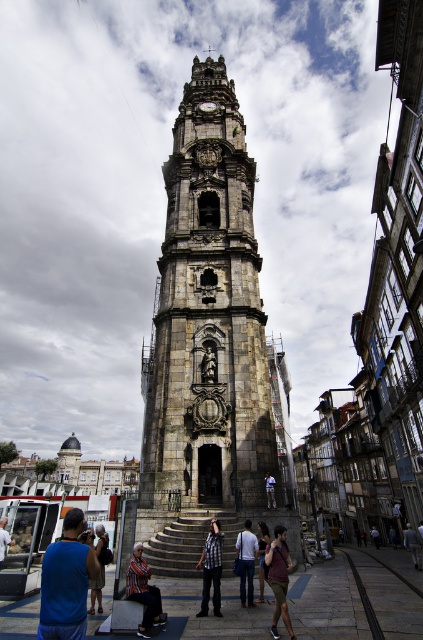
Question: Does checkered fabric shirt at center appear on the left side of light blue shirt at center?

Choices:
 (A) no
 (B) yes

Answer: (B)

Question: Considering the real-world distances, which object is farthest from the light brown leather jacket at lower right?

Choices:
 (A) gray fabric pants at lower center
 (B) striped fabric at center
 (C) matte gray clock at center

Answer: (C)

Question: Considering the relative positions of stone clock tower at center and light brown leather jacket at lower right in the image provided, where is stone clock tower at center located with respect to light brown leather jacket at lower right?

Choices:
 (A) above
 (B) below

Answer: (A)

Question: Which of the following is the closest to the observer?

Choices:
 (A) (213, 106)
 (B) (203, 573)
 (C) (0, 560)
 (D) (246, 557)

Answer: (D)

Question: Does stone clock tower at center appear on the right side of matte gray clock at center?

Choices:
 (A) yes
 (B) no

Answer: (B)

Question: Estimate the real-world distances between objects in this image. Which object is closer to the blue denim jeans at lower left?

Choices:
 (A) blue fabric shirt at lower left
 (B) checkered fabric shirt at center
 (C) dark blue shirt at center

Answer: (A)